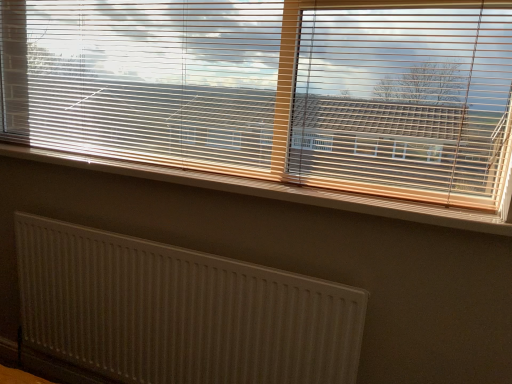
Question: Can you confirm if wooden blinds at upper center is wider than white textured radiator at lower left?

Choices:
 (A) no
 (B) yes

Answer: (B)

Question: Considering the relative sizes of wooden blinds at upper center and white textured radiator at lower left in the image provided, is wooden blinds at upper center taller than white textured radiator at lower left?

Choices:
 (A) no
 (B) yes

Answer: (B)

Question: Is wooden blinds at upper center oriented towards white textured radiator at lower left?

Choices:
 (A) yes
 (B) no

Answer: (B)

Question: Considering the relative positions of wooden blinds at upper center and white textured radiator at lower left in the image provided, is wooden blinds at upper center to the right of white textured radiator at lower left from the viewer's perspective?

Choices:
 (A) no
 (B) yes

Answer: (B)

Question: Can we say wooden blinds at upper center lies outside white textured radiator at lower left?

Choices:
 (A) no
 (B) yes

Answer: (B)

Question: Is wooden blinds at upper center beside white textured radiator at lower left?

Choices:
 (A) no
 (B) yes

Answer: (A)

Question: Does white textured radiator at lower left appear on the left side of wooden blinds at upper center?

Choices:
 (A) yes
 (B) no

Answer: (A)

Question: Does white textured radiator at lower left touch wooden blinds at upper center?

Choices:
 (A) no
 (B) yes

Answer: (A)

Question: Can you confirm if white textured radiator at lower left is positioned to the right of wooden blinds at upper center?

Choices:
 (A) yes
 (B) no

Answer: (B)

Question: Is white textured radiator at lower left positioned before wooden blinds at upper center?

Choices:
 (A) no
 (B) yes

Answer: (A)

Question: Can you confirm if white textured radiator at lower left is wider than wooden blinds at upper center?

Choices:
 (A) no
 (B) yes

Answer: (A)

Question: Does white textured radiator at lower left have a greater height compared to wooden blinds at upper center?

Choices:
 (A) no
 (B) yes

Answer: (A)

Question: Is white textured radiator at lower left aimed at white plastic radiator at lower center?

Choices:
 (A) no
 (B) yes

Answer: (A)